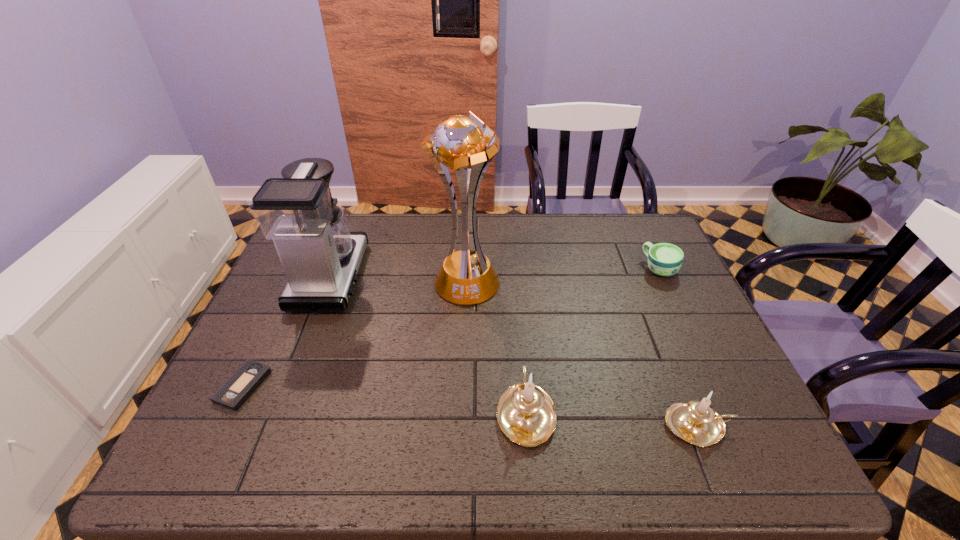
Please point a spot to add another candle holder on the left. Please provide its 2D coordinates. Your answer should be formatted as a tuple, i.e. [(x, y)], where the tuple contains the x and y coordinates of a point satisfying the conditions above.

[(362, 400)]